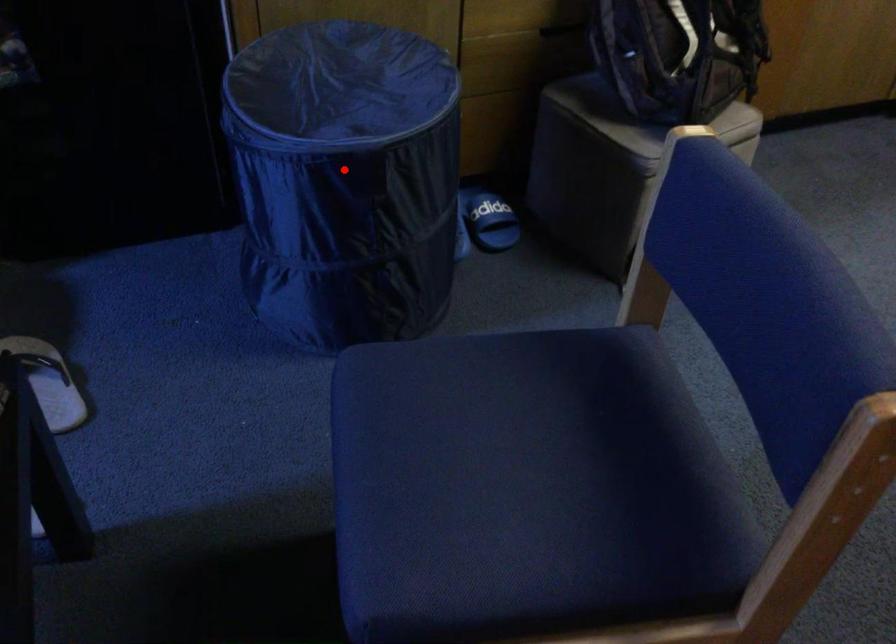
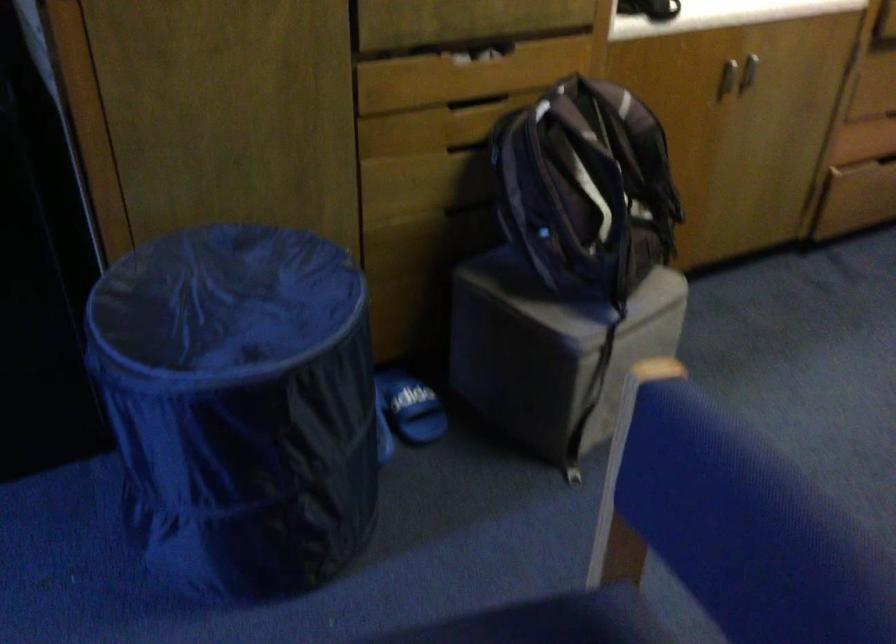
Find the pixel in the second image that matches the highlighted location in the first image.

(238, 406)